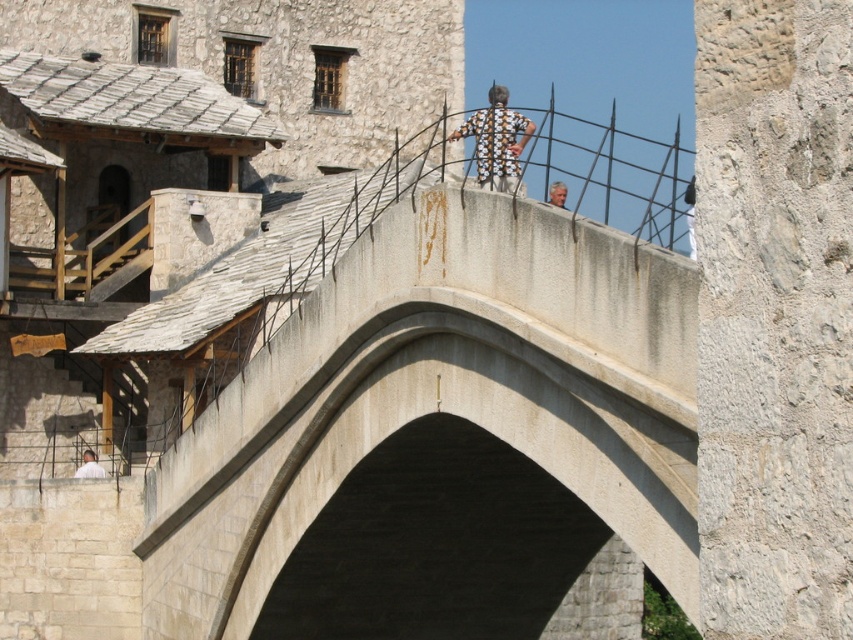
Question: Is smooth concrete bridge at center to the left of printed fabric shirt at center from the viewer's perspective?

Choices:
 (A) no
 (B) yes

Answer: (A)

Question: Which is nearer to the smooth concrete bridge at center?

Choices:
 (A) light gray stone person at lower left
 (B) printed fabric shirt at center
 (C) light brown hair at upper center

Answer: (B)

Question: Does light gray stone person at lower left have a greater width compared to light brown hair at upper center?

Choices:
 (A) yes
 (B) no

Answer: (B)

Question: Can you confirm if printed fabric shirt at center is thinner than light brown hair at upper center?

Choices:
 (A) yes
 (B) no

Answer: (A)

Question: Estimate the real-world distances between objects in this image. Which object is farther from the printed fabric shirt at center?

Choices:
 (A) smooth concrete bridge at center
 (B) light brown hair at upper center
 (C) light gray stone person at lower left

Answer: (C)

Question: Estimate the real-world distances between objects in this image. Which object is closer to the light brown hair at upper center?

Choices:
 (A) light gray stone person at lower left
 (B) smooth concrete bridge at center
 (C) printed fabric shirt at center

Answer: (B)